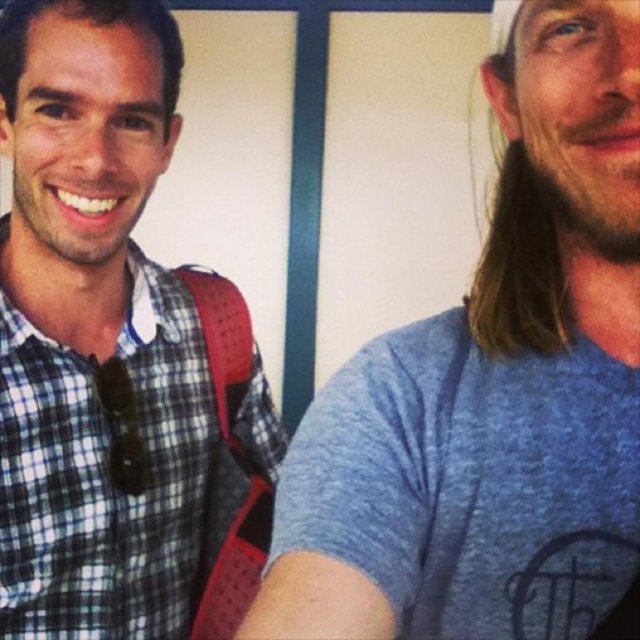
Based on the photo, you are trying to take a group photo with two people in the scene. The checkered fabric shirt at left and the brown fuzzy beard at right are standing side by side. Based on their heights, which person should stand in front to ensure both faces are visible in the photo?

The brown fuzzy beard at right should stand in front because the checkered fabric shirt at left is much taller, allowing the shorter person to be seen more clearly.